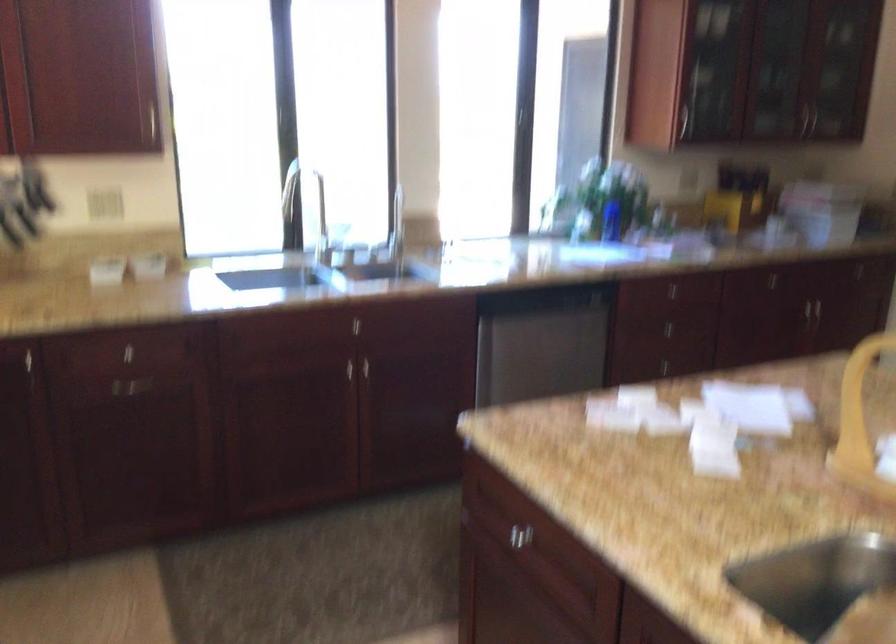
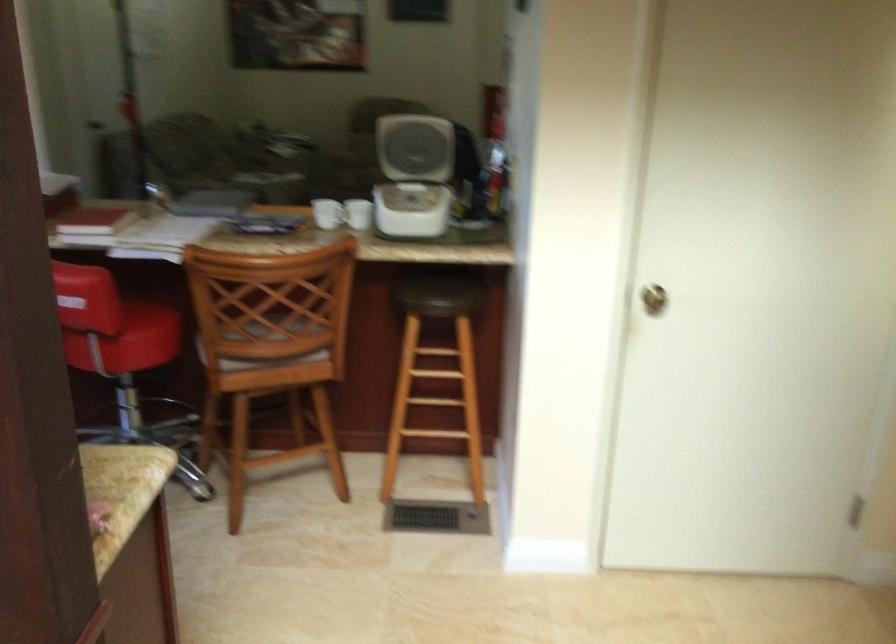
Question: Based on the continuous images, in which direction is the camera rotating? Reply with the corresponding letter.

Choices:
 (A) Left
 (B) Right
 (C) Up
 (D) Down

Answer: (B)